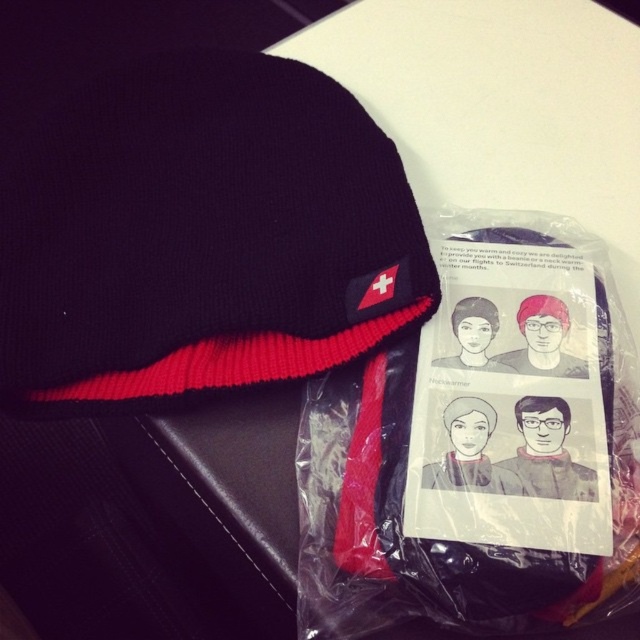
You are a customer in a Swiss souvenir shop holding a tape measure. You want to buy the black knitted beanie at center for your friend who has a head circumference of 22 inches. The beanie is displayed on a shelf. Can you determine if the beanie will fit your friend using the information provided?

The black knitted beanie at center is 27.04 inches away from the viewer, but this distance does not indicate its size. Without knowing the actual diameter or circumference of the beanie, you cannot determine if it will fit your friend.

You are organizing items on a table and need to place the matte plastic bag at center. According to the scene description, where should you position it relative to the black beanie with a red brim?

The matte plastic bag at center is located at point coordinates [477,449], so it should be placed to the right of the black beanie with a red brim since the coordinates indicate it is positioned there.

You are trying to determine if the black knitted beanie at center can fit inside the matte plastic bag at center. Based on their sizes, can the beanie fit inside the bag?

The black knitted beanie at center might be wider than matte plastic bag at center, so it may not fit inside the bag.